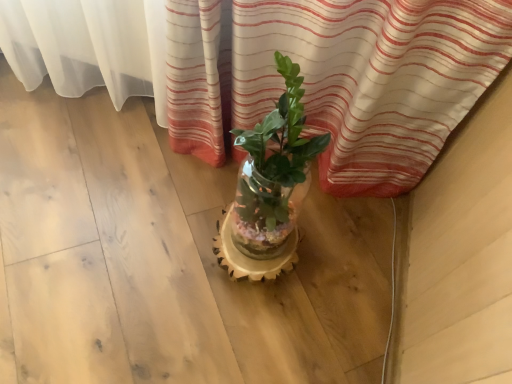
The image size is (512, 384). I want to click on vacant space to the right of translucent glass vase at center, so click(330, 271).